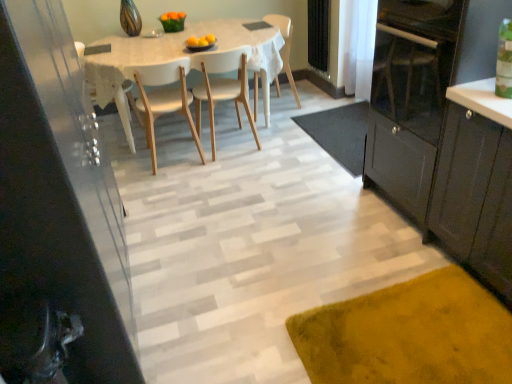
Question: Does matte black cabinet at left, which is the first cabinetry in left-to-right order, have a lesser width compared to white wood chair at center, positioned as the first chair in right-to-left order?

Choices:
 (A) yes
 (B) no

Answer: (B)

Question: Does matte black cabinet at left, which is the first cabinetry in left-to-right order, have a smaller size compared to white wood chair at center, positioned as the first chair in right-to-left order?

Choices:
 (A) yes
 (B) no

Answer: (B)

Question: Considering the relative positions of matte black cabinet at left, marked as the second cabinetry in a right-to-left arrangement, and white wood chair at center, positioned as the third chair in left-to-right order, in the image provided, is matte black cabinet at left, marked as the second cabinetry in a right-to-left arrangement, behind white wood chair at center, positioned as the third chair in left-to-right order,?

Choices:
 (A) yes
 (B) no

Answer: (B)

Question: Considering the relative positions of matte black cabinet at left, which is the first cabinetry in left-to-right order, and white wood chair at center, positioned as the first chair in right-to-left order, in the image provided, is matte black cabinet at left, which is the first cabinetry in left-to-right order, to the left of white wood chair at center, positioned as the first chair in right-to-left order, from the viewer's perspective?

Choices:
 (A) yes
 (B) no

Answer: (A)

Question: Does matte black cabinet at left, which is the first cabinetry in left-to-right order, have a greater width compared to white wood chair at center, positioned as the third chair in left-to-right order?

Choices:
 (A) yes
 (B) no

Answer: (A)

Question: From a real-world perspective, relative to white matte chair at center, placed as the first chair when sorted from left to right, is natural wood chair at center, the second chair in the left-to-right sequence, vertically above or below?

Choices:
 (A) below
 (B) above

Answer: (B)

Question: In terms of size, does natural wood chair at center, the second chair in the left-to-right sequence, appear bigger or smaller than white matte chair at center, which is the third chair in right-to-left order?

Choices:
 (A) big
 (B) small

Answer: (A)

Question: Based on their positions, is natural wood chair at center, the second chair in the left-to-right sequence, located to the left or right of white matte chair at center, which is the third chair in right-to-left order?

Choices:
 (A) left
 (B) right

Answer: (B)

Question: Looking at their shapes, would you say natural wood chair at center, the second chair in the left-to-right sequence, is wider or thinner than white matte chair at center, which is the third chair in right-to-left order?

Choices:
 (A) thin
 (B) wide

Answer: (B)

Question: Would you say dark gray wood cabinet at right, the 1th cabinetry positioned from the right, is to the left or to the right of white sheer curtain at upper right in the picture?

Choices:
 (A) left
 (B) right

Answer: (B)

Question: Would you say dark gray wood cabinet at right, the 1th cabinetry positioned from the right, is inside or outside white sheer curtain at upper right?

Choices:
 (A) inside
 (B) outside

Answer: (B)

Question: Relative to white sheer curtain at upper right, is dark gray wood cabinet at right, which ranks as the second cabinetry in left-to-right order, in front or behind?

Choices:
 (A) front
 (B) behind

Answer: (A)

Question: Considering the positions of dark gray wood cabinet at right, which ranks as the second cabinetry in left-to-right order, and white sheer curtain at upper right in the image, is dark gray wood cabinet at right, which ranks as the second cabinetry in left-to-right order, taller or shorter than white sheer curtain at upper right?

Choices:
 (A) short
 (B) tall

Answer: (B)

Question: Is white matte chair at center, placed as the first chair when sorted from left to right, wider or thinner than matte black cabinet at left, which is the first cabinetry in left-to-right order?

Choices:
 (A) thin
 (B) wide

Answer: (A)

Question: Is white matte chair at center, which is the third chair in right-to-left order, to the left or to the right of matte black cabinet at left, marked as the second cabinetry in a right-to-left arrangement, in the image?

Choices:
 (A) left
 (B) right

Answer: (B)